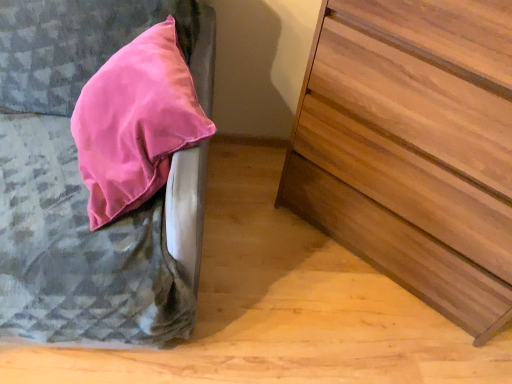
Question: From the image's perspective, is satin pink pillow at upper left above or below wooden chest of drawers at right?

Choices:
 (A) above
 (B) below

Answer: (A)

Question: Do you think satin pink pillow at upper left is within wooden chest of drawers at right, or outside of it?

Choices:
 (A) inside
 (B) outside

Answer: (B)

Question: Is satin pink pillow at upper left to the left or to the right of wooden chest of drawers at right in the image?

Choices:
 (A) right
 (B) left

Answer: (B)

Question: In the image, is wooden chest of drawers at right on the left side or the right side of satin pink pillow at upper left?

Choices:
 (A) left
 (B) right

Answer: (B)

Question: From a real-world perspective, is wooden chest of drawers at right positioned above or below satin pink pillow at upper left?

Choices:
 (A) below
 (B) above

Answer: (B)

Question: Is point (386, 228) closer or farther from the camera than point (11, 89)?

Choices:
 (A) farther
 (B) closer

Answer: (A)

Question: From the image's perspective, relative to satin pink pillow at upper left, is wooden chest of drawers at right above or below?

Choices:
 (A) above
 (B) below

Answer: (B)